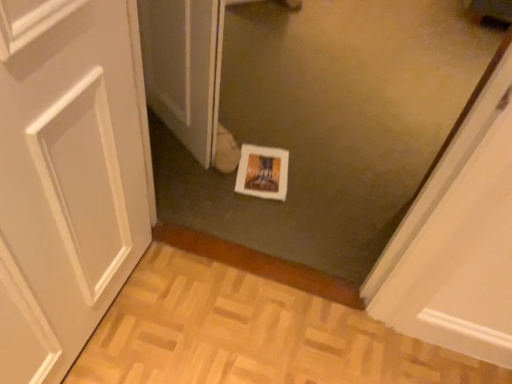
You are a GUI agent. You are given a task and a screenshot of the screen. Output one action in this format:
    pyautogui.click(x=<x>, y=<y>)
    Task: Click on the free space in front of white glossy print at center
    Image resolution: width=512 pixels, height=384 pixels.
    Given the screenshot: What is the action you would take?
    pyautogui.click(x=255, y=211)